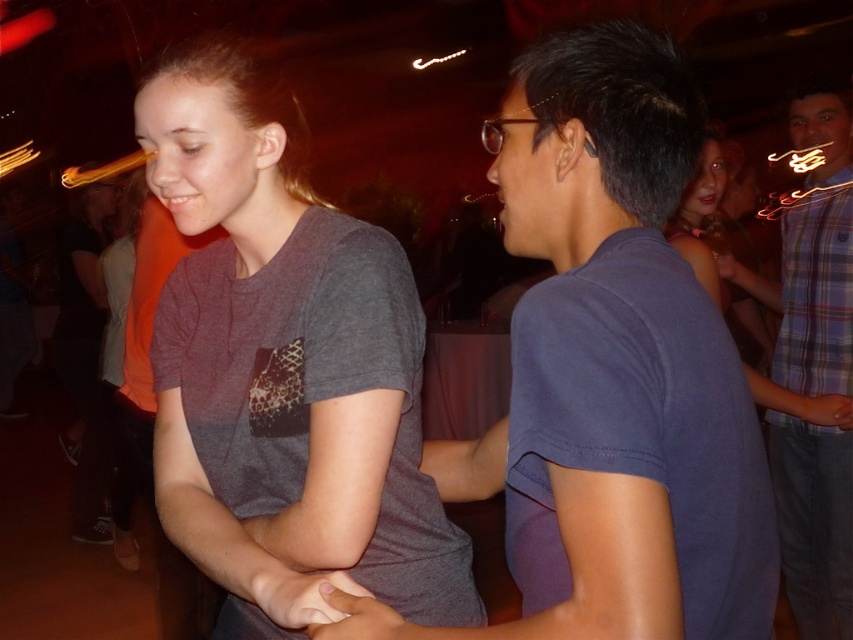
Where is `gray matte t-shirt at center`? gray matte t-shirt at center is located at coordinates (285, 369).

Which is below, gray matte t-shirt at center or plaid shirt at right?

plaid shirt at right

This screenshot has height=640, width=853. What are the coordinates of `gray matte t-shirt at center` in the screenshot? It's located at (285, 369).